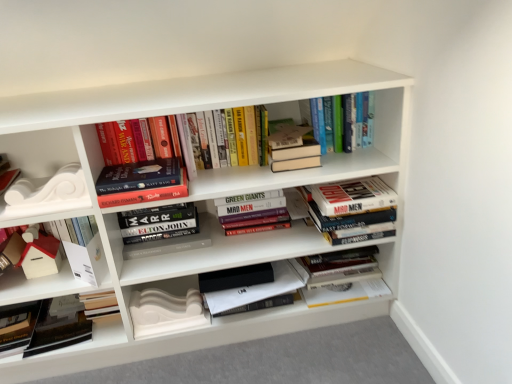
Question: From the image's perspective, is hardcover books at center, the fifth book when ordered from right to left, located above or below white matte house at left, the first book from the left?

Choices:
 (A) above
 (B) below

Answer: (A)

Question: From a real-world perspective, is hardcover books at center, the fifth book when ordered from right to left, positioned above or below white matte house at left, the first book from the left?

Choices:
 (A) below
 (B) above

Answer: (A)

Question: Estimate the real-world distances between objects in this image. Which object is farther from the hardcover books at center, the fifth book when ordered from right to left?

Choices:
 (A) hardcover books at center, placed as the 7th book when sorted from right to left
 (B) hardcover book at center, the fourth book when ordered from right to left
 (C) black matte book at lower left, the second book from the left
 (D) white matte paper at lower left, the 2th paperback book when ordered from left to right
 (E) white matte decorative molding at lower left, which is the first paperback book from right to left

Answer: (C)

Question: Estimate the real-world distances between objects in this image. Which object is closer to the white matte bookshelf at center, which is the first shelf in right-to-left order?

Choices:
 (A) white matte house at left, acting as the 10th book starting from the right
 (B) black matte book at lower left, the second book from the left
 (C) hardcover books at upper center, the fifth book from the left
 (D) white matte paper at lower left, arranged as the second paperback book when viewed from the right
 (E) matte black book at lower left, which is counted as the 1th paperback book, starting from the left

Answer: (C)